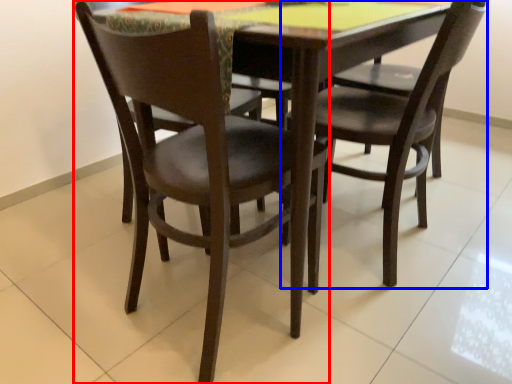
Question: Which point is further to the camera, chair (highlighted by a red box) or chair (highlighted by a blue box)?

Choices:
 (A) chair
 (B) chair

Answer: (B)